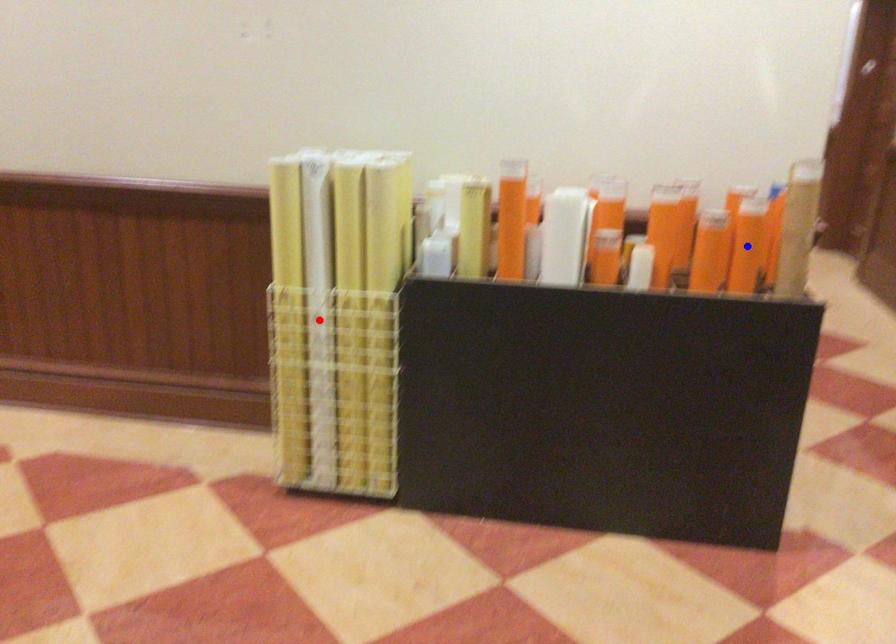
Question: In the image, two points are highlighted. Which point is nearer to the camera? Reply with the corresponding letter.

Choices:
 (A) blue point
 (B) red point

Answer: (A)